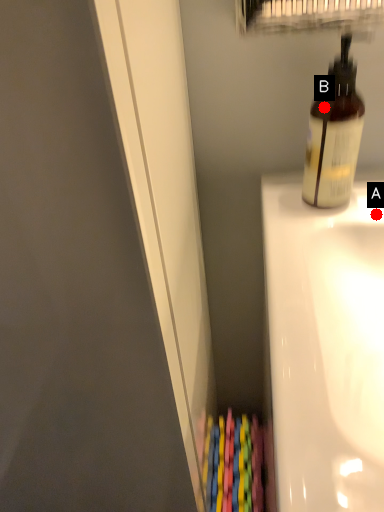
Question: Two points are circled on the image, labeled by A and B beside each circle. Among these points, which one is nearest to the camera?

Choices:
 (A) A is closer
 (B) B is closer

Answer: (B)